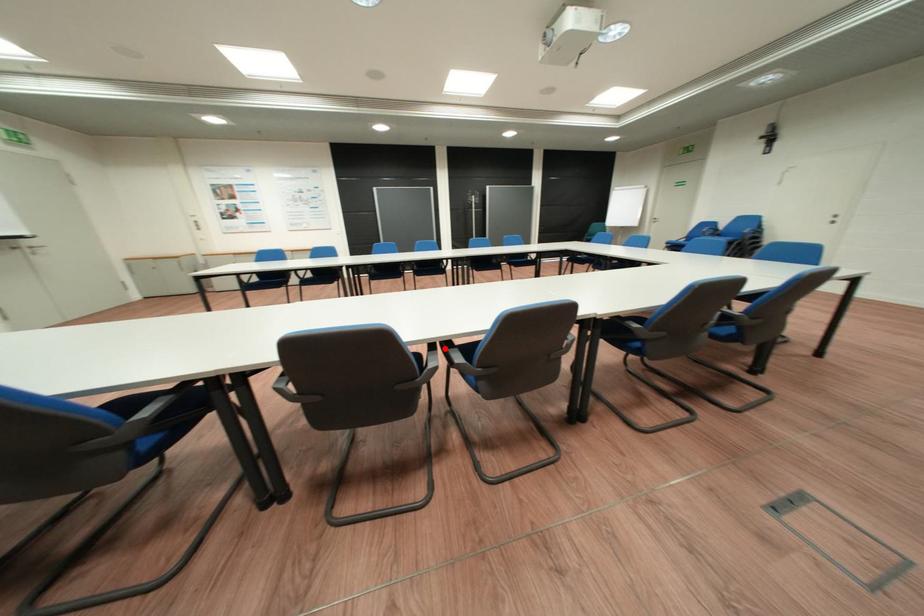
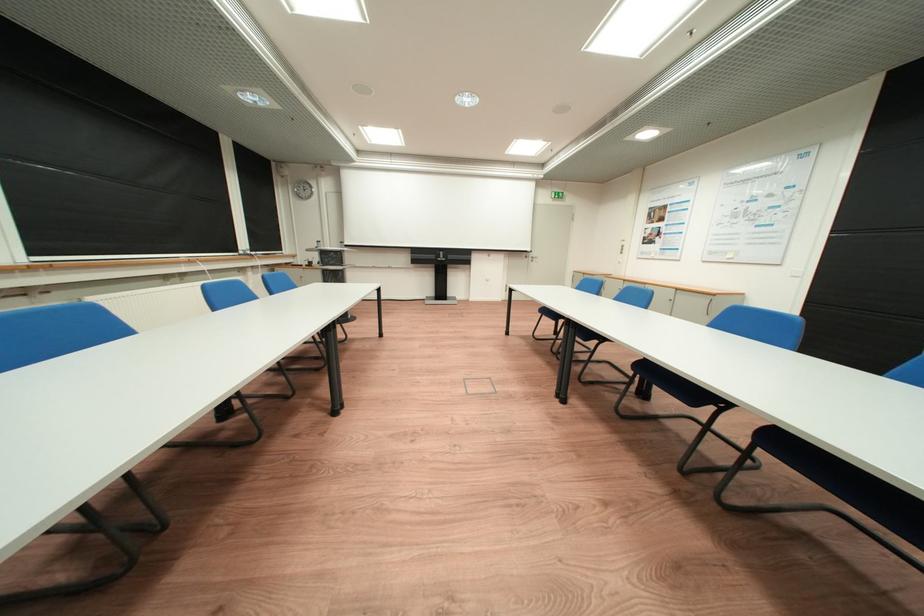
Question: I am providing you with two images of the same scene from different viewpoints. A red point is marked on the first image. Is the red point's position out of view in image 2?

Choices:
 (A) Yes
 (B) No

Answer: (A)